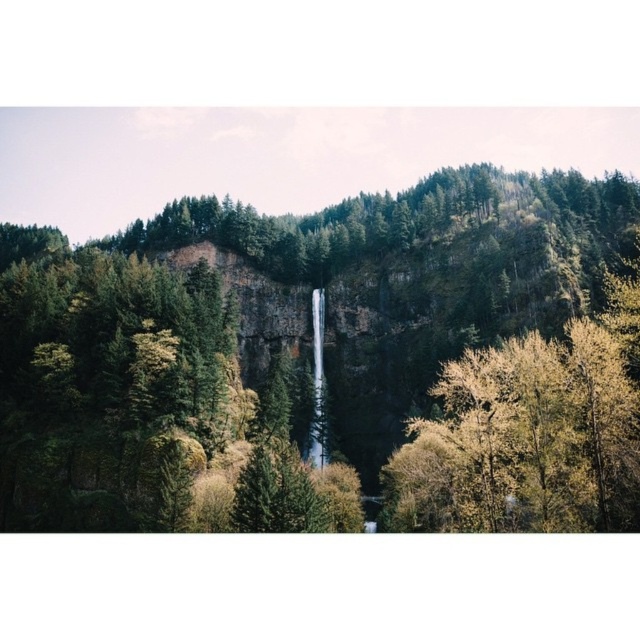
Question: Can you confirm if green matte forest at center is positioned below transparent glass waterfall at center?

Choices:
 (A) yes
 (B) no

Answer: (B)

Question: Does green matte forest at center have a greater width compared to transparent glass waterfall at center?

Choices:
 (A) yes
 (B) no

Answer: (A)

Question: Which object is farther from the camera taking this photo?

Choices:
 (A) transparent glass waterfall at center
 (B) green matte forest at center

Answer: (A)

Question: Considering the relative positions of green matte forest at center and transparent glass waterfall at center in the image provided, where is green matte forest at center located with respect to transparent glass waterfall at center?

Choices:
 (A) above
 (B) below

Answer: (A)